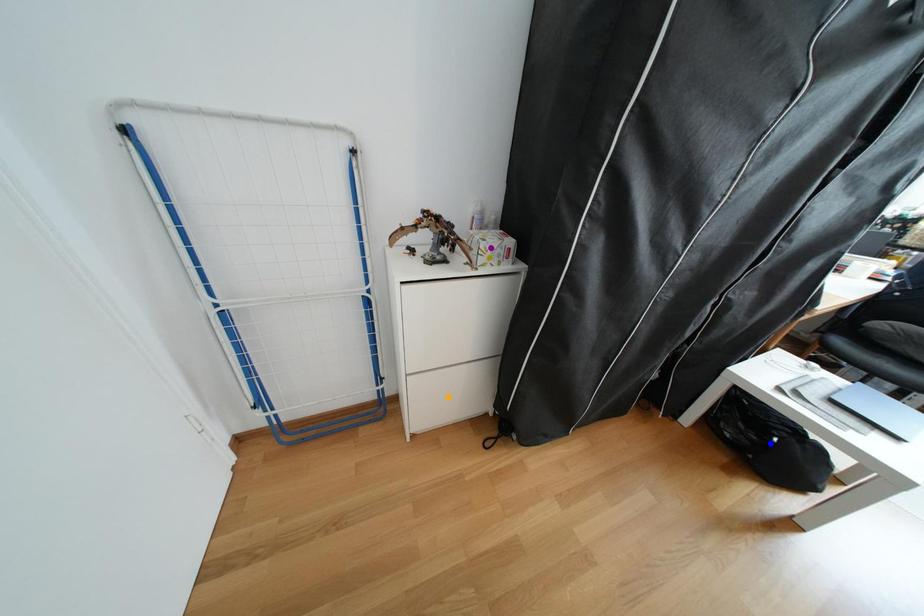
Order these from nearest to farthest:
1. purple point
2. blue point
3. orange point

blue point → orange point → purple point